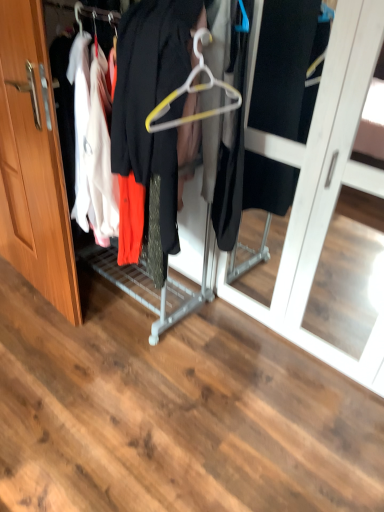
Question: Is metallic hanger at center a part of white plastic hanger at center?

Choices:
 (A) yes
 (B) no

Answer: (B)

Question: Is white plastic hanger at center shorter than metallic hanger at center?

Choices:
 (A) yes
 (B) no

Answer: (A)

Question: Is white plastic hanger at center at the right side of metallic hanger at center?

Choices:
 (A) no
 (B) yes

Answer: (B)

Question: Is white plastic hanger at center to the left of metallic hanger at center from the viewer's perspective?

Choices:
 (A) no
 (B) yes

Answer: (A)

Question: Is white plastic hanger at center far from metallic hanger at center?

Choices:
 (A) yes
 (B) no

Answer: (B)

Question: From the image's perspective, relative to metallic hanger at center, is white plastic hanger at center above or below?

Choices:
 (A) above
 (B) below

Answer: (A)

Question: From a real-world perspective, is white plastic hanger at center physically located above or below metallic hanger at center?

Choices:
 (A) above
 (B) below

Answer: (A)

Question: In the image, is white plastic hanger at center on the left side or the right side of metallic hanger at center?

Choices:
 (A) right
 (B) left

Answer: (A)

Question: Is point (193, 40) closer or farther from the camera than point (56, 224)?

Choices:
 (A) farther
 (B) closer

Answer: (B)

Question: Based on their positions, is white plastic hanger at center located to the left or right of wooden door at left?

Choices:
 (A) left
 (B) right

Answer: (B)

Question: Considering the positions of white plastic hanger at center and wooden door at left in the image, is white plastic hanger at center wider or thinner than wooden door at left?

Choices:
 (A) wide
 (B) thin

Answer: (A)

Question: Is point (205, 41) closer or farther from the camera than point (61, 287)?

Choices:
 (A) closer
 (B) farther

Answer: (A)

Question: From a real-world perspective, is white plastic hanger at center positioned above or below wooden door at left?

Choices:
 (A) below
 (B) above

Answer: (B)

Question: Is wooden door at left in front of or behind white plastic hanger at center in the image?

Choices:
 (A) front
 (B) behind

Answer: (B)

Question: Is wooden door at left inside or outside of white plastic hanger at center?

Choices:
 (A) outside
 (B) inside

Answer: (A)